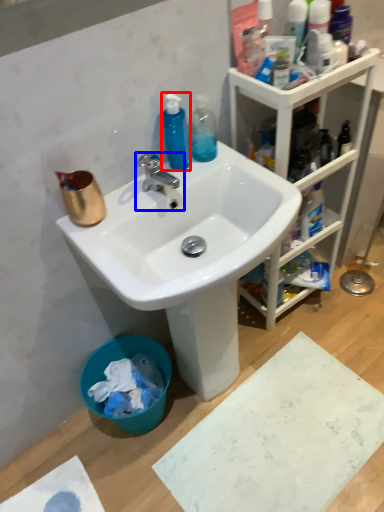
Question: Which point is closer to the camera, cleaning product (highlighted by a red box) or tap (highlighted by a blue box)?

Choices:
 (A) cleaning product
 (B) tap

Answer: (B)